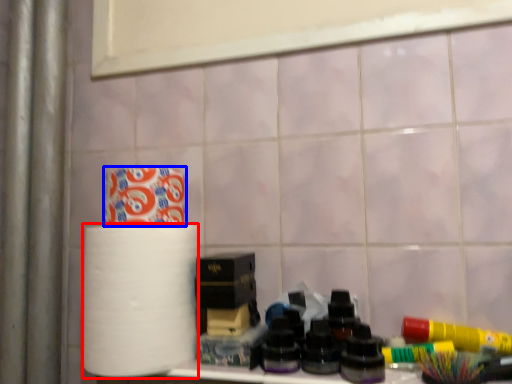
Question: Which object is closer to the camera taking this photo, paper towel (highlighted by a red box) or toilet paper (highlighted by a blue box)?

Choices:
 (A) paper towel
 (B) toilet paper

Answer: (A)